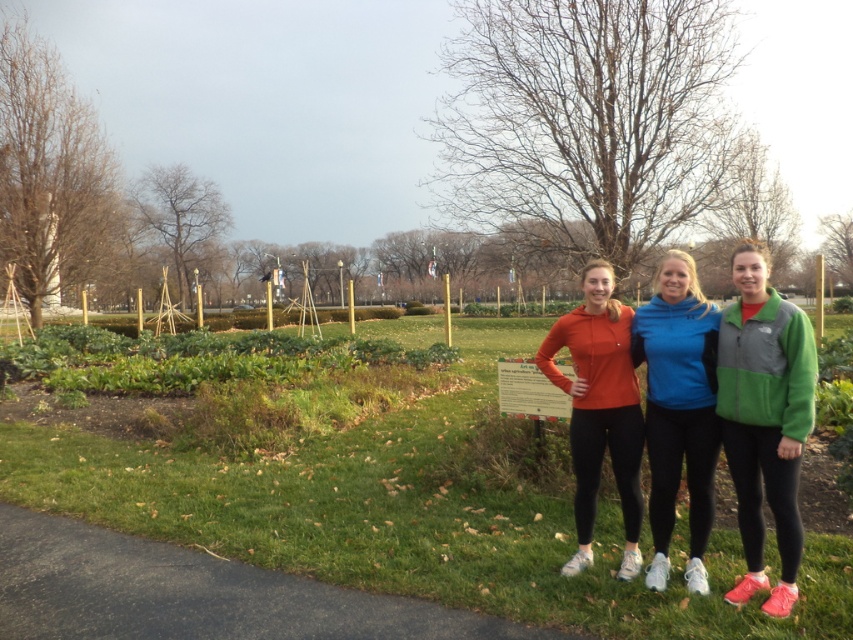
You are a photographer trying to focus on the blue fleece jacket at center in the image. However, the green grass at center is blocking your view. Can you adjust your camera to focus on the jacket without moving the grass?

The green grass at center is closer to the viewer than the blue fleece jacket at center, so you need to adjust the camera focus to the blue fleece jacket at center by moving the focus point beyond the grass.

What are the coordinates of the blue fleece jacket at center?

The blue fleece jacket at center is located at coordinates point (677, 410).